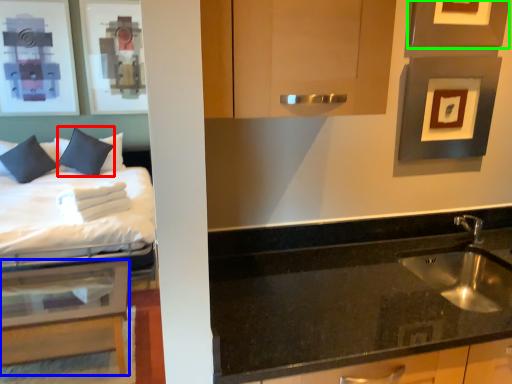
Question: Which is farther away from pillow (highlighted by a red box)? table (highlighted by a blue box) or picture frame (highlighted by a green box)?

Choices:
 (A) table
 (B) picture frame

Answer: (B)